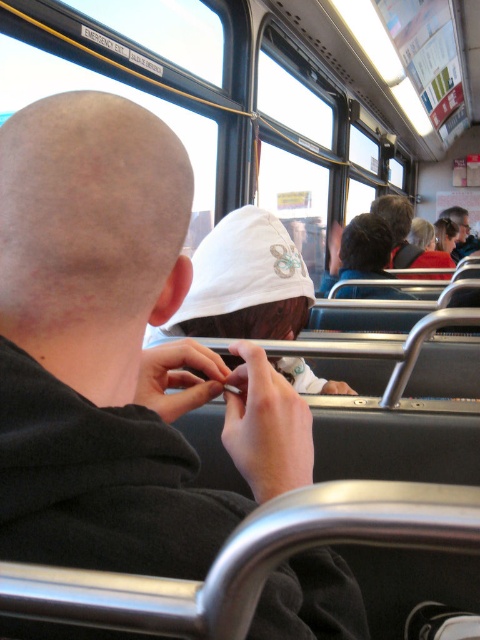
Question: Which is nearer to the smooth skin head at upper right?

Choices:
 (A) white fabric hat at center
 (B) bald scalp at center
 (C) matte white headband at center
 (D) dark brown hair at center

Answer: (C)

Question: Which point is farther to the camera?

Choices:
 (A) bald scalp at center
 (B) smooth skin head at upper right
 (C) dark brown hair at upper center
 (D) white fabric hat at center

Answer: (B)

Question: Does white fabric hat at center have a lesser width compared to dark brown hair at upper center?

Choices:
 (A) no
 (B) yes

Answer: (B)

Question: Does white fabric hat at center have a lesser width compared to matte white headband at center?

Choices:
 (A) no
 (B) yes

Answer: (B)

Question: Does bald scalp at center appear on the right side of dark brown hair at center?

Choices:
 (A) no
 (B) yes

Answer: (A)

Question: Which point is farther from the camera taking this photo?

Choices:
 (A) (268, 403)
 (B) (45, 280)

Answer: (A)